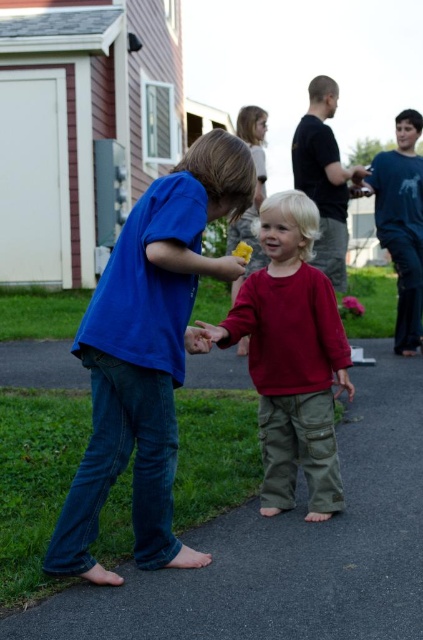
You are a delivery person who needs to place a small package on the ground between the black asphalt pavement at center and the blue cotton shirt at center. Can you fit the package between them without overlapping either object?

The black asphalt pavement at center is wider than the blue cotton shirt at center, so there is enough space between them to place the package without overlapping either object.

You are a photographer standing at the edge of the driveway. You want to take a photo that includes both the black asphalt pavement at center and the blue cotton shirt at center. Which object should you focus on first to ensure both are in clear focus?

You should focus on the black asphalt pavement at center first because it is closer to the viewer than the blue cotton shirt at center. By focusing on the closer object, the farther one may still be in focus depending on the depth of field.

You are a photographer trying to capture a closeup of the blue cotton shirt at center and the matte red shirt at center. Since you want both shirts to appear equally sharp in the photo, which shirt should you focus on and why?

You should focus on the blue cotton shirt at center because it is larger in size than the matte red shirt at center, so focusing on the larger shirt will ensure both are in focus when using depth of field properly.